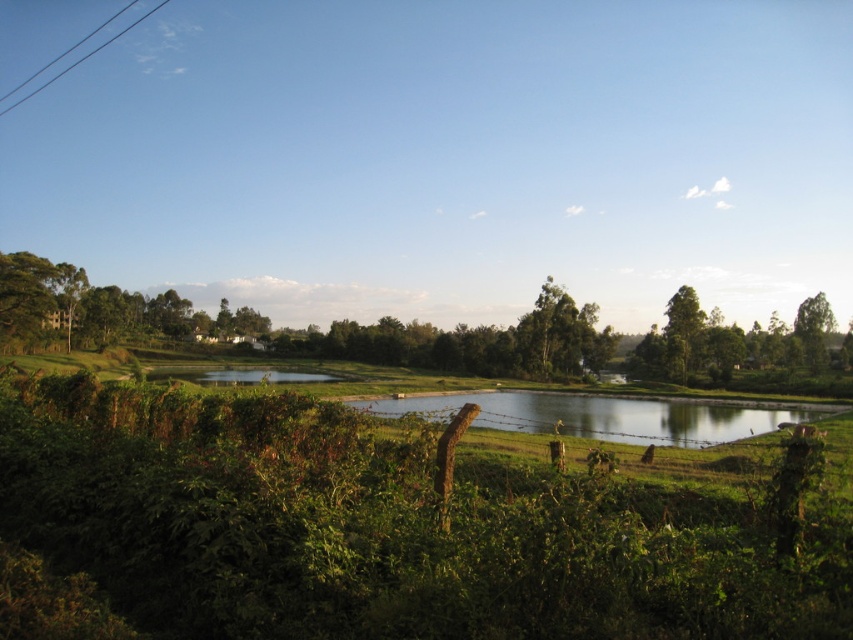
Question: Among these objects, which one is nearest to the camera?

Choices:
 (A) green leafy shrubs at center
 (B) black wire at upper left
 (C) green leafy tree at center

Answer: (A)

Question: Is the position of green leafy tree at center less distant than that of black wire at upper left?

Choices:
 (A) no
 (B) yes

Answer: (B)

Question: Which point appears closest to the camera in this image?

Choices:
 (A) (84, 38)
 (B) (573, 326)

Answer: (B)

Question: Which of the following is the closest to the observer?

Choices:
 (A) (280, 440)
 (B) (804, 336)
 (C) (26, 99)
 (D) (550, 364)

Answer: (A)

Question: Does green leafy tree at right have a greater width compared to black wire at upper left?

Choices:
 (A) yes
 (B) no

Answer: (B)

Question: Does green leafy tree at center appear over green leafy tree at right?

Choices:
 (A) no
 (B) yes

Answer: (B)